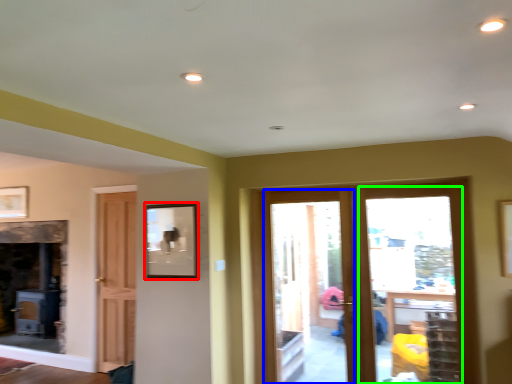
Question: Which object is the farthest from picture frame (highlighted by a red box)? Choose among these: screen door (highlighted by a blue box) or glass door (highlighted by a green box).

Choices:
 (A) screen door
 (B) glass door

Answer: (A)